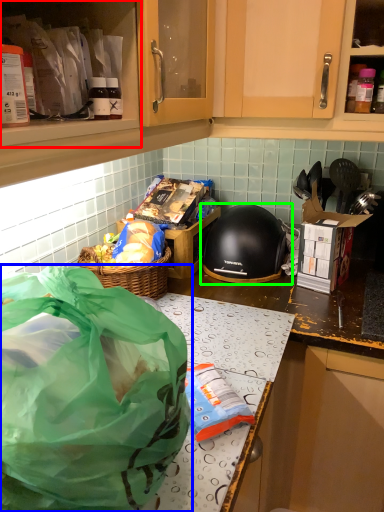
Question: Based on their relative distances, which object is nearer to cabinetry (highlighted by a red box)? Choose from plastic bag (highlighted by a blue box) and helmet (highlighted by a green box).

Choices:
 (A) plastic bag
 (B) helmet

Answer: (A)